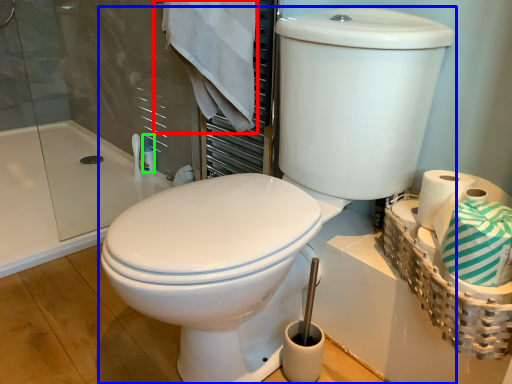
Question: Which is nearer to the bath towel (highlighted by a red box)? toilet (highlighted by a blue box) or toiletry (highlighted by a green box).

Choices:
 (A) toilet
 (B) toiletry

Answer: (A)